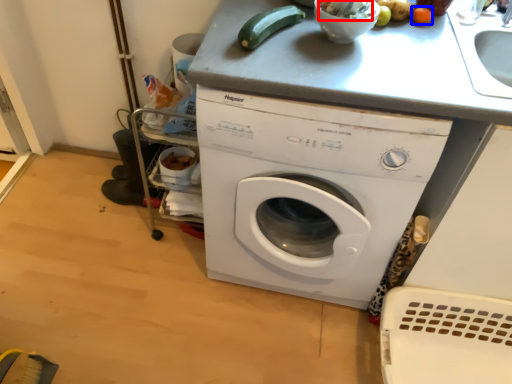
Question: Which object appears closest to the camera in this image, food (highlighted by a red box) or vegetable (highlighted by a blue box)?

Choices:
 (A) food
 (B) vegetable

Answer: (A)